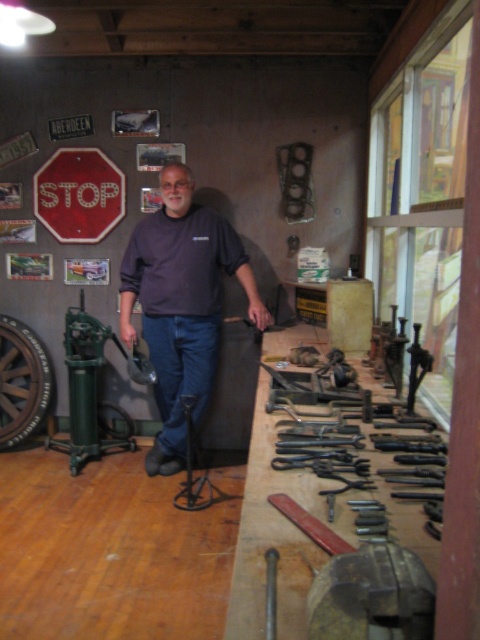
You are an observer in the workshop. You notice the dark blue shirt at center and the red matte stop sign at center. Which object is located more to the right?

The dark blue shirt at center is positioned on the right side of red matte stop sign at center, so the dark blue shirt at center is more to the right.

You are a painter who needs to paint both the red matte stop sign at center and the metallic flat at center. You have a ladder that is 3 meters tall. Can you reach both objects with your ladder without moving it?

The distance between the red matte stop sign at center and the metallic flat at center is 3.25 meters. Since the ladder is only 3 meters tall, you cannot reach both objects without moving the ladder because the distance exceeds the ladder length.